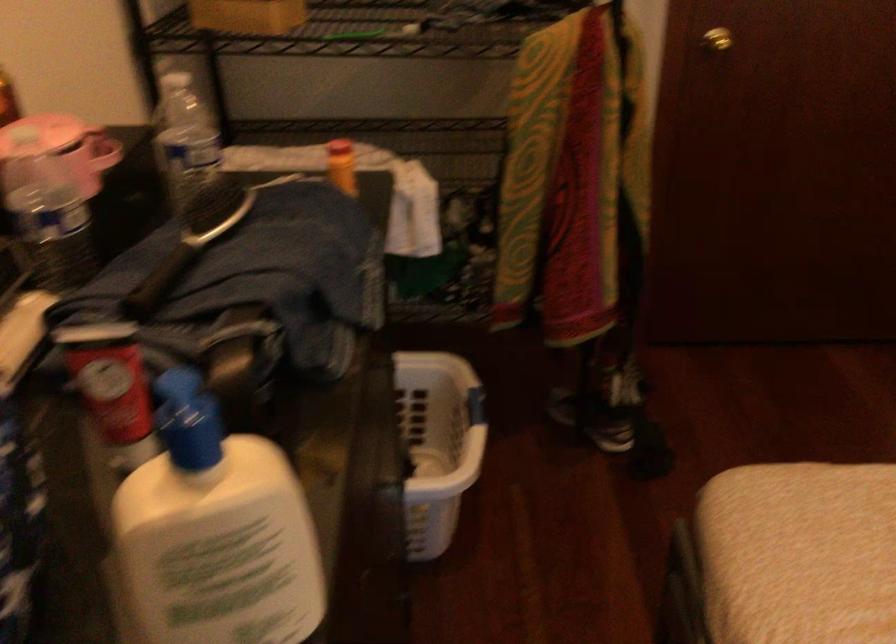
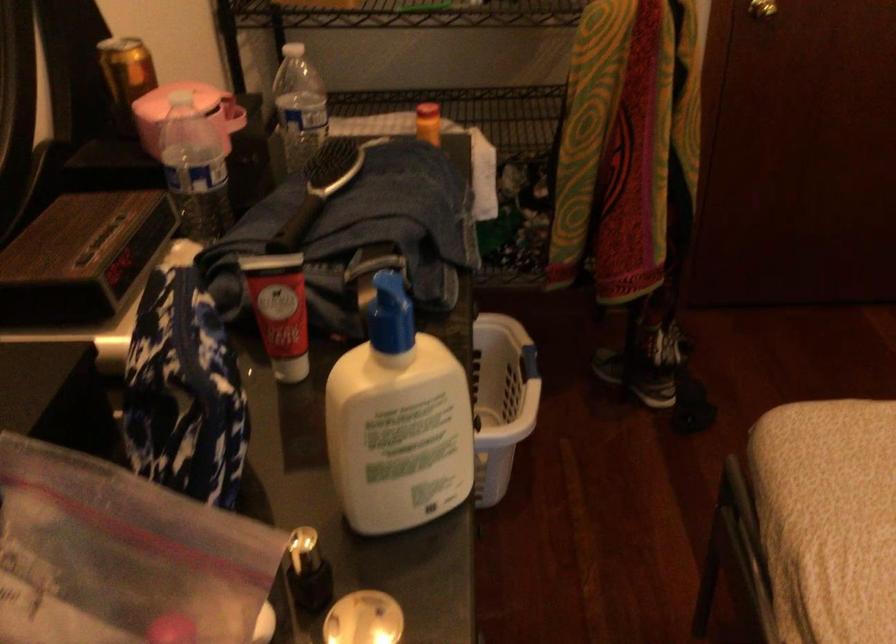
What movement of the cameraman would produce the second image?

The cameraman walked toward left, backward.